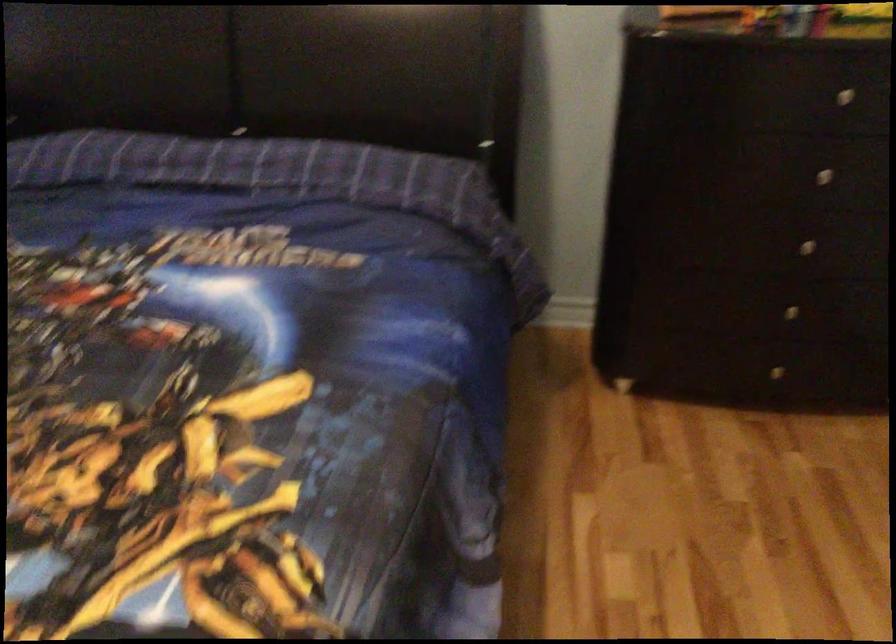
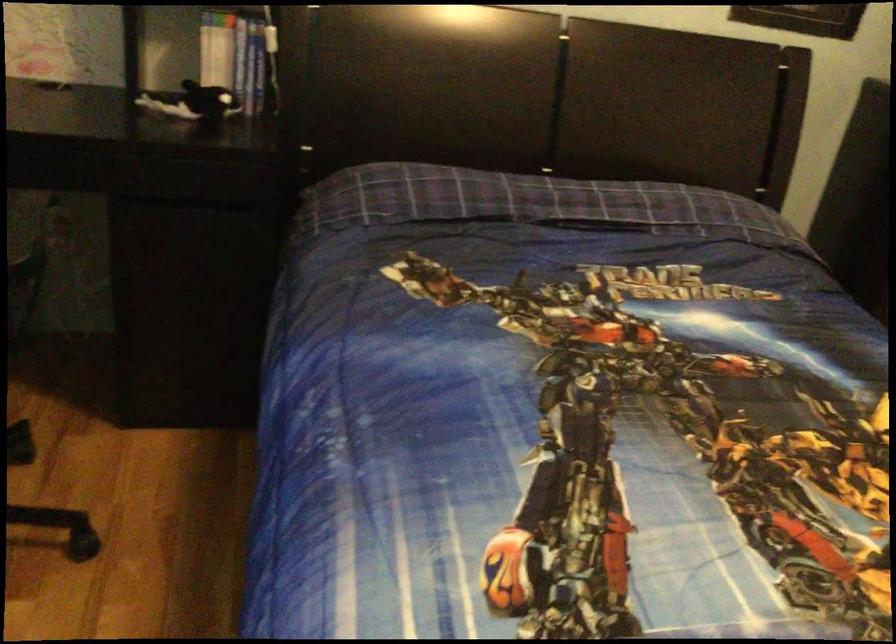
Question: Which direction would the cameraman need to move to produce the second image? Reply with the corresponding letter.

Choices:
 (A) Left
 (B) Right
 (C) Forward
 (D) Backward

Answer: (A)